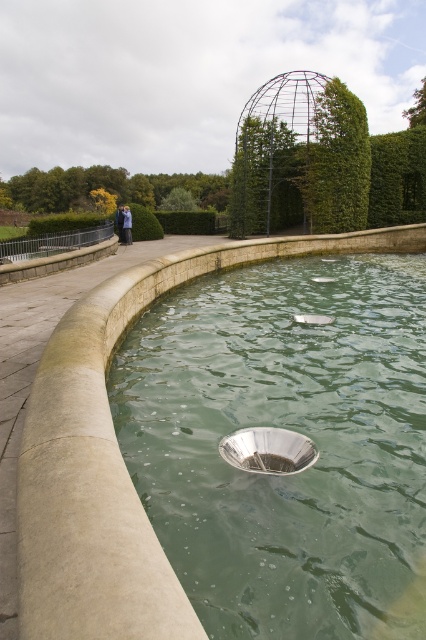
Question: Is metallic silver pool at center to the right of blue fabric jacket at upper left from the viewer's perspective?

Choices:
 (A) no
 (B) yes

Answer: (B)

Question: Which of the following is the closest to the observer?

Choices:
 (A) tap(129, 220)
 (B) tap(121, 204)

Answer: (A)

Question: Which point is farther from the camera taking this photo?

Choices:
 (A) (382, 152)
 (B) (120, 220)
 (C) (351, 148)
 (D) (304, 499)

Answer: (A)

Question: Does metallic silver pool at center appear over green leafy hedge at upper center?

Choices:
 (A) no
 (B) yes

Answer: (A)

Question: Among these points, which one is nearest to the camera?

Choices:
 (A) (258, 435)
 (B) (278, 497)
 (C) (120, 237)
 (D) (325, 200)

Answer: (B)

Question: Is green leafy hedge at upper center closer to the viewer compared to green leafy hedge at upper right?

Choices:
 (A) yes
 (B) no

Answer: (A)